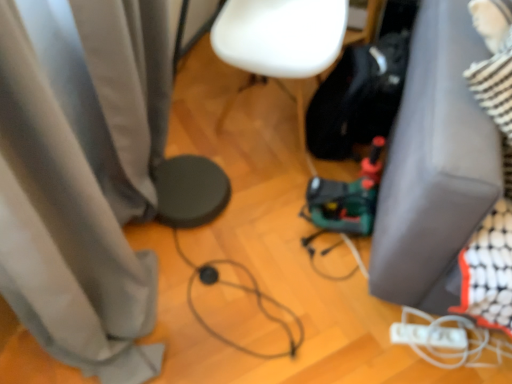
Image resolution: width=512 pixels, height=384 pixels. What do you see at coordinates (243, 290) in the screenshot?
I see `black cable at center` at bounding box center [243, 290].

The height and width of the screenshot is (384, 512). Find the location of `gray fabric couch at lower right`. gray fabric couch at lower right is located at coordinates (435, 166).

At what (x,y) coordinates should I click in order to perform the action: click on white matte chair at center. Please return your answer as a coordinate pair (x, y). Looking at the image, I should click on (280, 35).

Considering the positions of objects white matte wii controller at lower right and black cable at center in the image provided, who is in front, white matte wii controller at lower right or black cable at center?

Positioned in front is black cable at center.

Looking at this image, from a real-world perspective, is white matte wii controller at lower right under black cable at center?

No, from a real-world perspective, white matte wii controller at lower right is not below black cable at center.

Consider the image. Can you confirm if white matte wii controller at lower right is wider than black cable at center?

In fact, white matte wii controller at lower right might be narrower than black cable at center.

Does white matte wii controller at lower right have a larger size compared to black cable at center?

Incorrect, white matte wii controller at lower right is not larger than black cable at center.

Considering the sizes of objects white matte chair at center and white matte wii controller at lower right in the image provided, who is taller, white matte chair at center or white matte wii controller at lower right?

white matte chair at center is taller.

Between white matte chair at center and white matte wii controller at lower right, which one appears on the left side from the viewer's perspective?

white matte chair at center.

Which point is more forward, (320, 2) or (467, 343)?

The point (467, 343) is more forward.

Find the location of a particular element. wire lying in front of the white matte wii controller at lower right is located at coordinates (243, 290).

Is black cable at center bigger or smaller than white matte wii controller at lower right?

black cable at center is bigger than white matte wii controller at lower right.

Is black cable at center inside the boundaries of white matte wii controller at lower right, or outside?

black cable at center is spatially situated outside white matte wii controller at lower right.

Which object is positioned more to the right, black cable at center or white matte wii controller at lower right?

white matte wii controller at lower right is more to the right.

In the image, there is a gray fabric couch at lower right. Identify the location of armchair above it (from the image's perspective). The width and height of the screenshot is (512, 384). (280, 35).

Is gray fabric couch at lower right spatially inside white matte chair at center, or outside of it?

The correct answer is: outside.

From a real-world perspective, does white matte chair at center stand above gray fabric couch at lower right?

No.

From the image's perspective, is white matte chair at center beneath gray fabric couch at lower right?

No, from the image's perspective, white matte chair at center is not beneath gray fabric couch at lower right.

Can we say white matte chair at center lies outside gray fabric couch at lower right?

Absolutely, white matte chair at center is external to gray fabric couch at lower right.

Is white matte wii controller at lower right shorter than gray fabric couch at lower right?

Indeed, white matte wii controller at lower right has a lesser height compared to gray fabric couch at lower right.

Which object is wider, white matte wii controller at lower right or gray fabric couch at lower right?

Wider between the two is gray fabric couch at lower right.

Is white matte wii controller at lower right to the left of gray fabric couch at lower right from the viewer's perspective?

Correct, you'll find white matte wii controller at lower right to the left of gray fabric couch at lower right.

Is white matte wii controller at lower right smaller than gray fabric couch at lower right?

Correct, white matte wii controller at lower right occupies less space than gray fabric couch at lower right.

From the image's perspective, would you say gray fabric couch at lower right is shown under black cable at center?

No, from the image's perspective, gray fabric couch at lower right is not beneath black cable at center.

From a real-world perspective, is gray fabric couch at lower right on black cable at center?

Indeed, from a real-world perspective, gray fabric couch at lower right stands above black cable at center.

Is gray fabric couch at lower right thinner than black cable at center?

No, gray fabric couch at lower right is not thinner than black cable at center.

Is gray fabric couch at lower right to the left or to the right of black cable at center in the image?

gray fabric couch at lower right is positioned on black cable at center's right side.

Find the location of a particular element. This screenshot has height=384, width=512. wire on the left of white matte wii controller at lower right is located at coordinates (243, 290).

Where is `Wii controller behind the white matte chair at center`? The width and height of the screenshot is (512, 384). Wii controller behind the white matte chair at center is located at coordinates (428, 335).

Which object lies nearer to the anchor point black cable at center, white matte chair at center or gray fabric couch at lower right?

Based on the image, gray fabric couch at lower right appears to be nearer to black cable at center.

Consider the image. Which object lies further to the anchor point black cable at center, white matte wii controller at lower right or gray fabric couch at lower right?

gray fabric couch at lower right.

Which object lies nearer to the anchor point white matte chair at center, white matte wii controller at lower right or black cable at center?

black cable at center lies closer to white matte chair at center than the other object.

Based on the photo, considering their positions, is black cable at center positioned closer to white matte wii controller at lower right than gray fabric couch at lower right?

black cable at center is positioned closer to the anchor white matte wii controller at lower right.

Looking at the image, which one is located closer to white matte chair at center, gray fabric couch at lower right or white matte wii controller at lower right?

gray fabric couch at lower right is closer to white matte chair at center.

Based on their spatial positions, is black cable at center or gray fabric couch at lower right closer to white matte chair at center?

The object closer to white matte chair at center is gray fabric couch at lower right.

Considering their positions, is gray fabric couch at lower right positioned further to white matte chair at center than black cable at center?

black cable at center lies further to white matte chair at center than the other object.

Estimate the real-world distances between objects in this image. Which object is closer to white matte wii controller at lower right, gray fabric couch at lower right or white matte chair at center?

Among the two, gray fabric couch at lower right is located nearer to white matte wii controller at lower right.

Where is `wire between white matte chair at center and white matte wii controller at lower right vertically`? This screenshot has width=512, height=384. wire between white matte chair at center and white matte wii controller at lower right vertically is located at coordinates [x=243, y=290].

What are the coordinates of `Wii controller located between black cable at center and gray fabric couch at lower right in the left-right direction` in the screenshot? It's located at (428, 335).

Find the location of a particular element. This screenshot has height=384, width=512. armchair between black cable at center and gray fabric couch at lower right is located at coordinates (280, 35).

At what (x,y) coordinates should I click in order to perform the action: click on furniture between white matte chair at center and white matte wii controller at lower right from top to bottom. Please return your answer as a coordinate pair (x, y). Looking at the image, I should click on (435, 166).